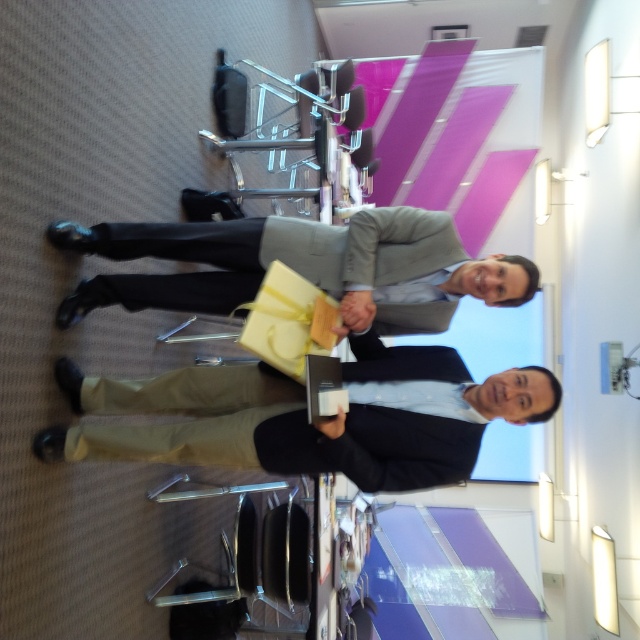
Consider the image. You are organizing a gift presentation at the conference table. You have a matte black book at lower center and a matte gray suit at center. Which object is located to the right of the other?

The matte black book at lower center is positioned on the right side of the matte gray suit at center.

You are organizing a conference and need to place a 12 inch wide decorative item between the matte black book at lower center and the matte gray suit at center. Can you fit it there?

The distance between the matte black book at lower center and the matte gray suit at center is 12.21 inches, so yes, the 12 inch wide decorative item can fit between them since it is slightly narrower than the available space.

You are organizing a gift presentation and need to place the matte black book at lower center and the matte gray suit at center on a shelf. Which object should you place first to ensure they both fit side by side?

The matte black book at lower center might be wider than the matte gray suit at center, so you should place the wider object first to ensure both fit side by side.